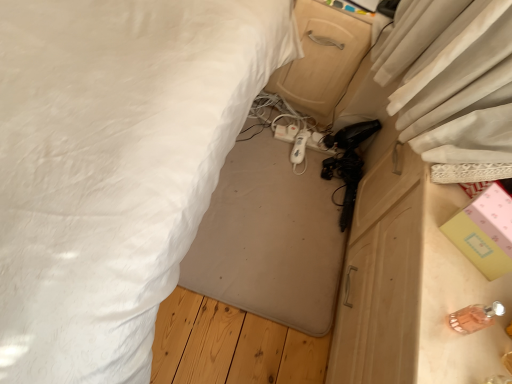
Locate an element on the screen. free space behind white matte remote control at center, the 1th equipment from the left is located at coordinates [300, 118].